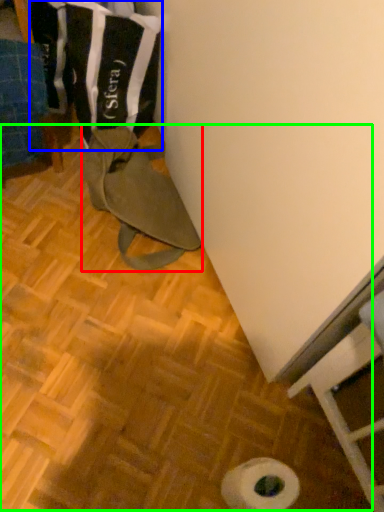
Question: Which is farther away from wide (highlighted by a red box)? laundry (highlighted by a blue box) or wood (highlighted by a green box)?

Choices:
 (A) laundry
 (B) wood

Answer: (A)